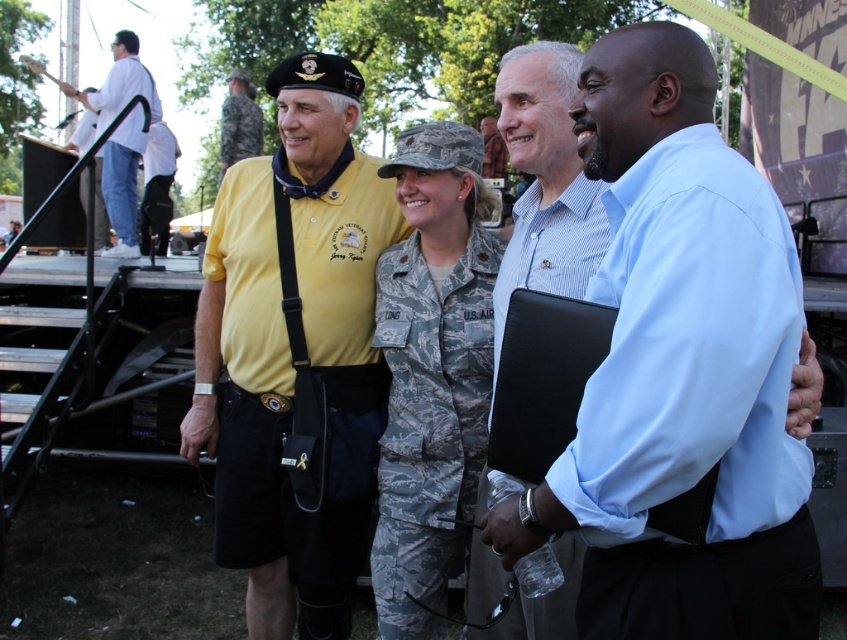
Looking at this image, between camo uniform at center and yellow uniform at center, which one has more height?

yellow uniform at center is taller.

Where is `camo uniform at center`? The width and height of the screenshot is (847, 640). camo uniform at center is located at coordinates click(x=430, y=371).

Based on the photo, does white cotton shirt at upper left have a lesser height compared to yellow uniform at center?

Yes, white cotton shirt at upper left is shorter than yellow uniform at center.

Can you confirm if white cotton shirt at upper left is taller than yellow uniform at center?

Incorrect, white cotton shirt at upper left's height is not larger of yellow uniform at center's.

This screenshot has height=640, width=847. Find the location of `white cotton shirt at upper left`. white cotton shirt at upper left is located at coordinates (123, 177).

This screenshot has height=640, width=847. Identify the location of white cotton shirt at upper left. (123, 177).

How distant is yellow shirt at center from yellow uniform at center?

A distance of 18.26 feet exists between yellow shirt at center and yellow uniform at center.

Looking at this image, does yellow shirt at center have a smaller size compared to yellow uniform at center?

Yes.

Locate an element on the screen. yellow shirt at center is located at coordinates (291, 352).